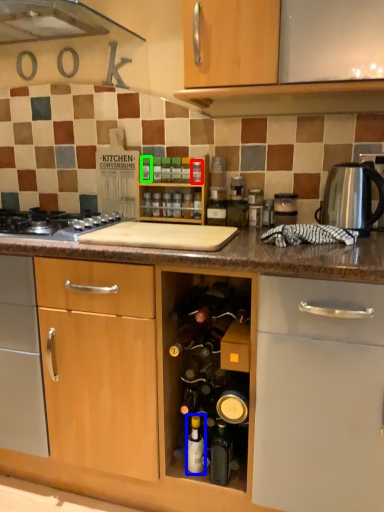
Question: Which is nearer to the bottle (highlighted by a red box)? bottle (highlighted by a blue box) or bottle (highlighted by a green box).

Choices:
 (A) bottle
 (B) bottle

Answer: (B)